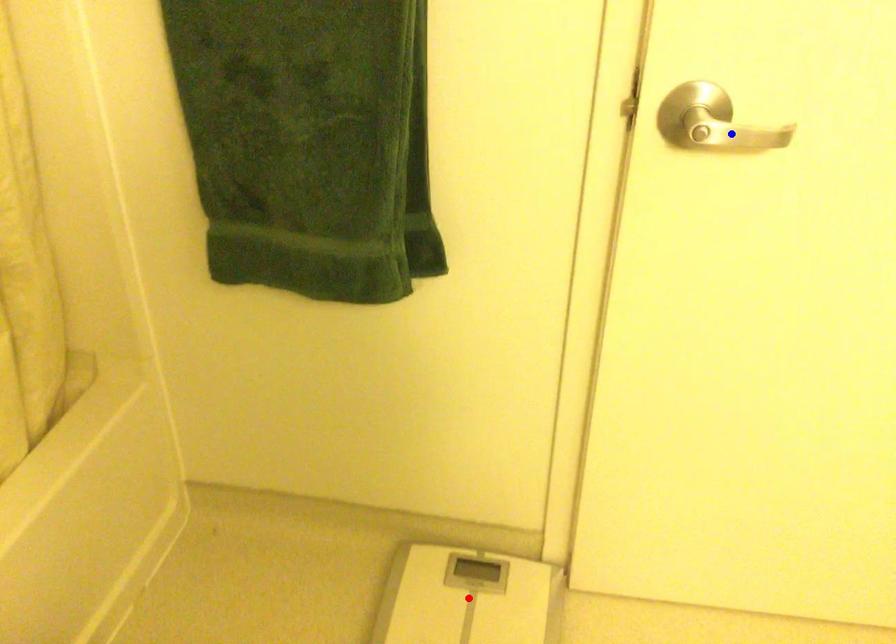
Question: In the image, two points are highlighted. Which point is nearer to the camera? Reply with the corresponding letter.

Choices:
 (A) blue point
 (B) red point

Answer: (A)